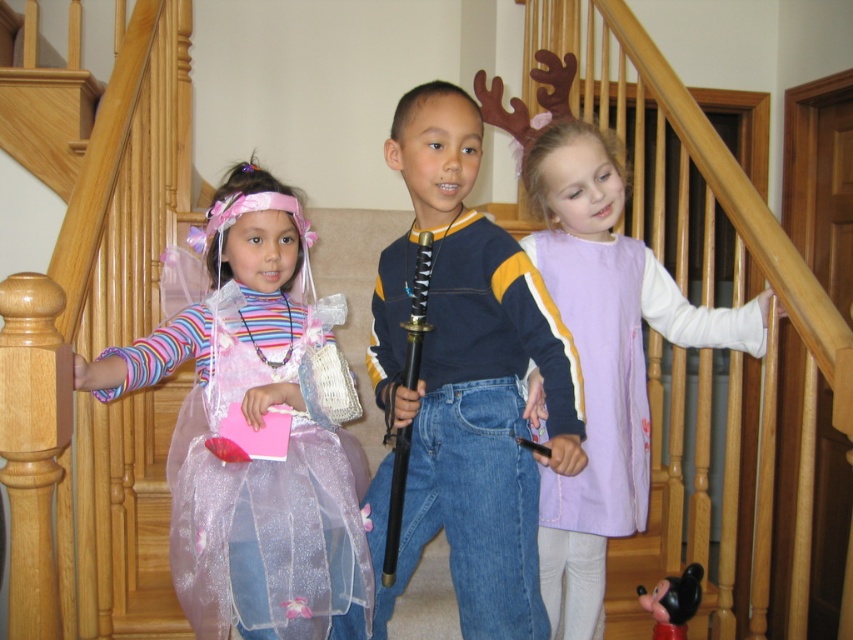
Question: Is blue denim jeans at center behind purple fabric dress at center?

Choices:
 (A) yes
 (B) no

Answer: (B)

Question: Which point is closer to the camera?

Choices:
 (A) purple fabric dress at center
 (B) sparkly tulle dress at center

Answer: (B)

Question: Among these objects, which one is farthest from the camera?

Choices:
 (A) purple fabric dress at center
 (B) blue denim jeans at center
 (C) sparkly tulle dress at center

Answer: (A)

Question: Can you confirm if sparkly tulle dress at center is positioned below purple fabric dress at center?

Choices:
 (A) no
 (B) yes

Answer: (A)

Question: Does sparkly tulle dress at center have a larger size compared to purple fabric dress at center?

Choices:
 (A) no
 (B) yes

Answer: (A)

Question: Among these points, which one is farthest from the camera?

Choices:
 (A) (428, 400)
 (B) (561, 563)

Answer: (B)